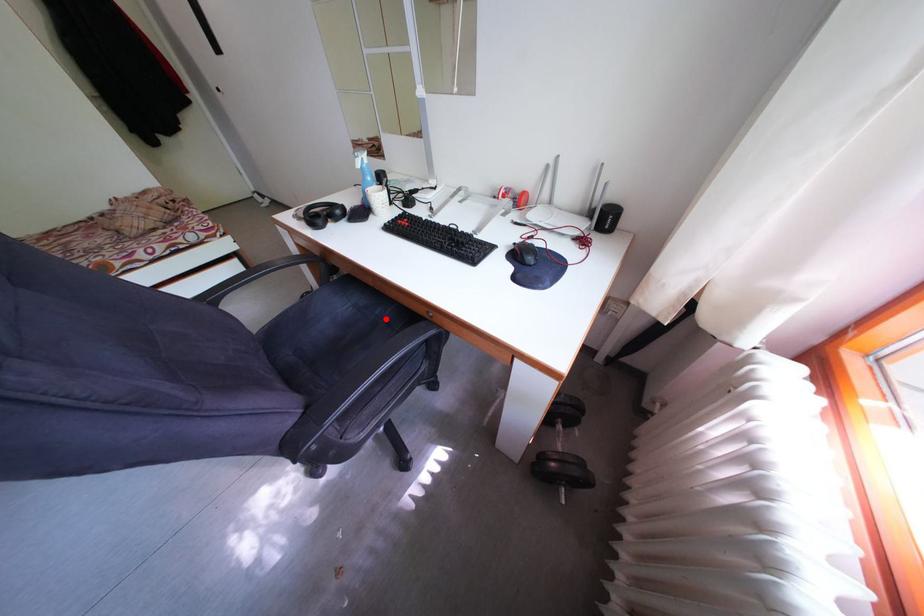
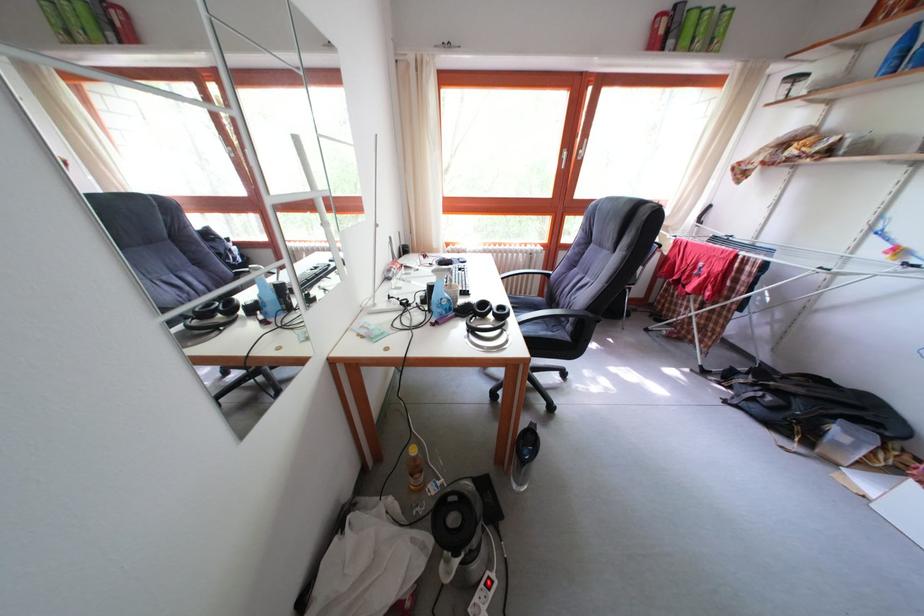
Question: I am providing you with two images of the same scene from different viewpoints. A red point is marked on the first image. At the location where the point appears in image 1, is it still visible in image 2?

Choices:
 (A) Yes
 (B) No

Answer: (B)